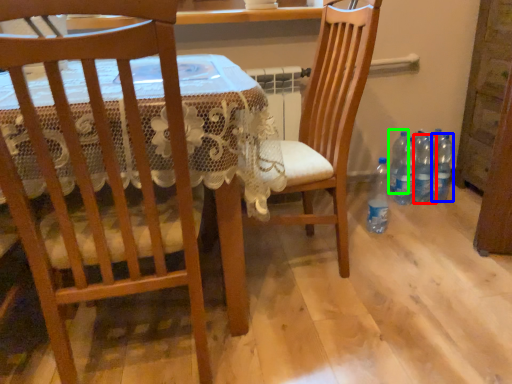
Question: Which object is positioned farthest from bottle (highlighted by a red box)? Select from bottle (highlighted by a blue box) and bottle (highlighted by a green box).

Choices:
 (A) bottle
 (B) bottle

Answer: (B)